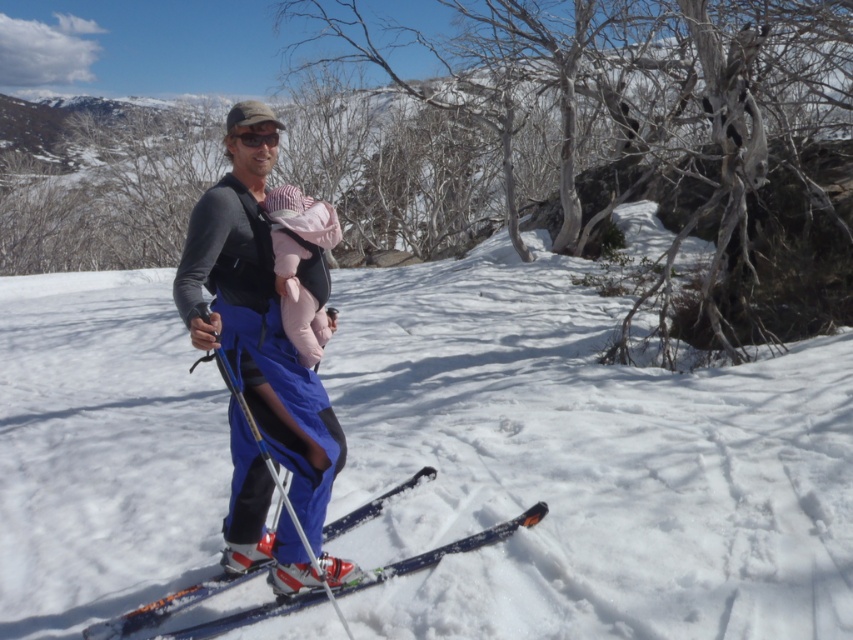
You are a drone operator trying to capture a photo of the man with the baby in the snowy slope. The camera is currently focused at point 0.7, 0.6. To ensure the white fluffy snow at center is in the frame, should you adjust the camera focus to the right or left?

Since the white fluffy snow at center is located at point [583,464], which is slightly to the right and above the current focus point of [511,448], you should adjust the camera focus to the right and upwards to include it in the frame.

You are a photographer trying to capture the man and his baby on the slope. You notice the white fluffy snow at center and the blue metallic ski at center. Which object is nearer to your camera lens?

The white fluffy snow at center is closer to the viewer than the blue metallic ski at center, so the snow will appear nearer to the camera lens.

You are a photographer trying to capture the man and his baby on the slope. You notice the metallic silver ski pole at center and the blue metallic ski at center. Which object is closer to the camera?

The blue metallic ski at center is closer to the camera because the metallic silver ski pole at center is behind it.